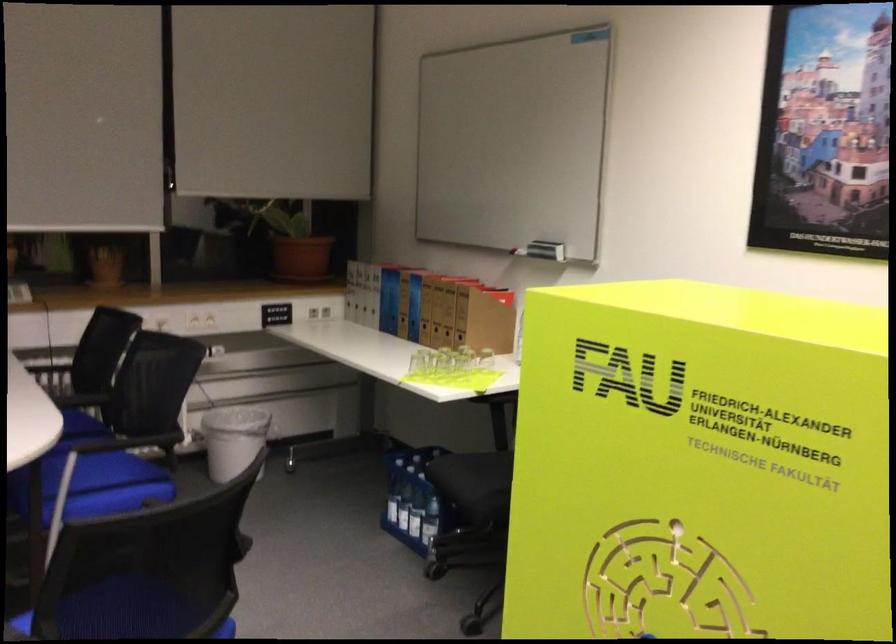
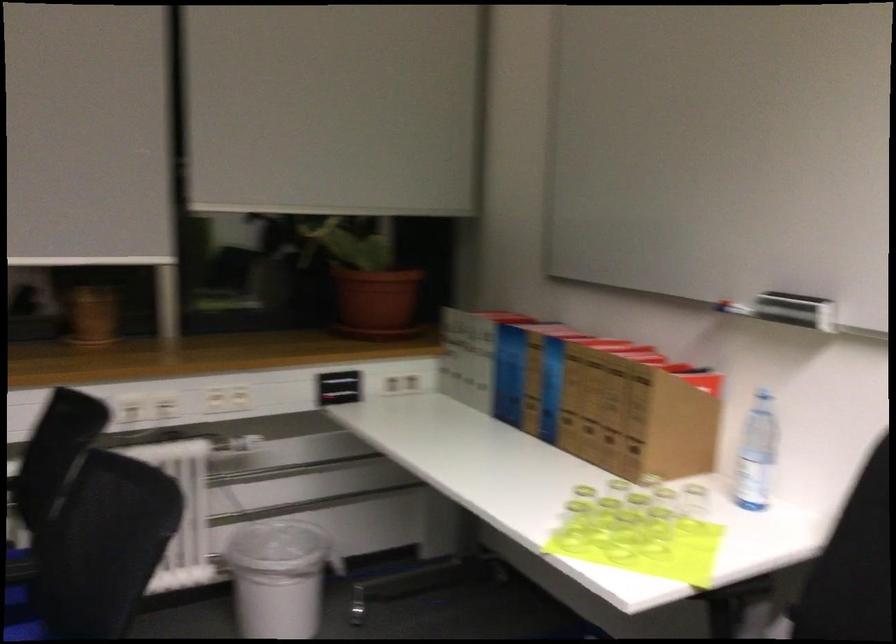
Where in the second image is the point corresponding to point (463, 316) from the first image?

(634, 417)